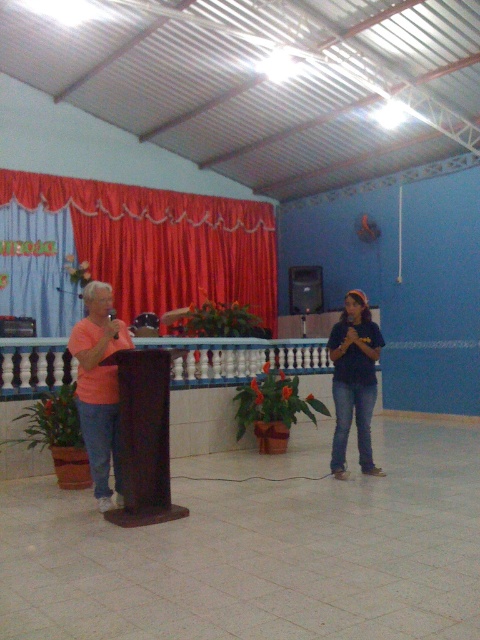
Question: Based on their relative distances, which object is farther from the red velvet curtain at upper left?

Choices:
 (A) blue cotton shirt at center
 (B) brown polished wood podium at center

Answer: (B)

Question: Which object is positioned closest to the brown polished wood podium at center?

Choices:
 (A) red velvet curtain at upper left
 (B) blue cotton shirt at center

Answer: (B)

Question: Which object is the farthest from the brown polished wood podium at center?

Choices:
 (A) matte orange shirt at left
 (B) blue cotton shirt at center
 (C) red velvet curtain at upper left

Answer: (C)

Question: Is red velvet curtain at upper left bigger than brown polished wood podium at center?

Choices:
 (A) no
 (B) yes

Answer: (B)

Question: Can you confirm if red velvet curtain at upper left is wider than matte orange shirt at left?

Choices:
 (A) yes
 (B) no

Answer: (A)

Question: Does red velvet curtain at upper left have a smaller size compared to brown polished wood podium at center?

Choices:
 (A) no
 (B) yes

Answer: (A)